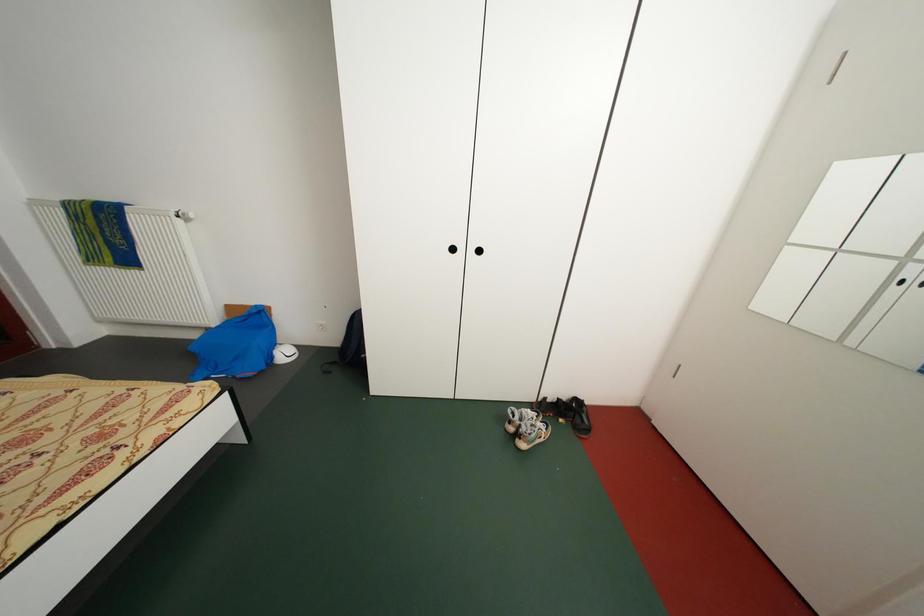
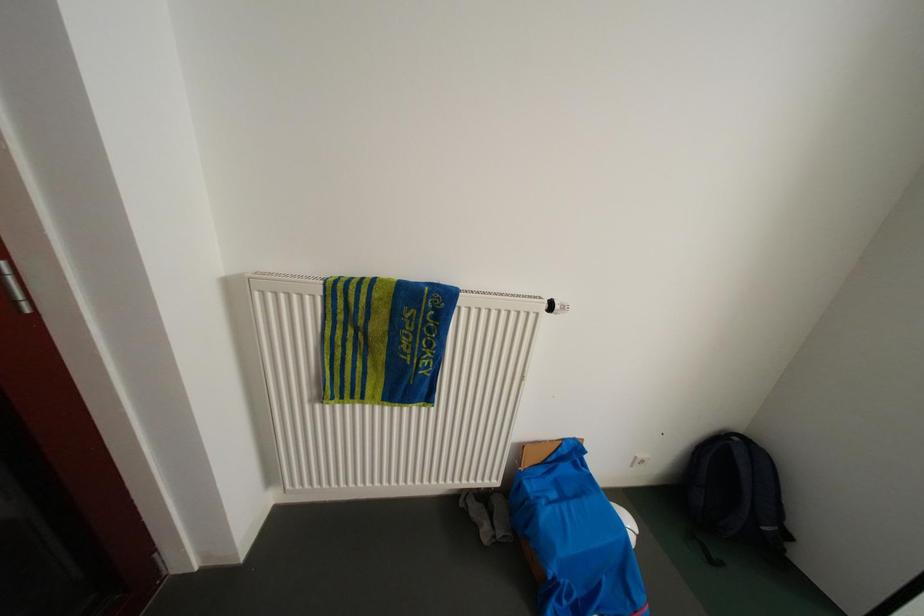
Which direction would the cameraman need to move to produce the second image?

The cameraman moved toward left, forward.